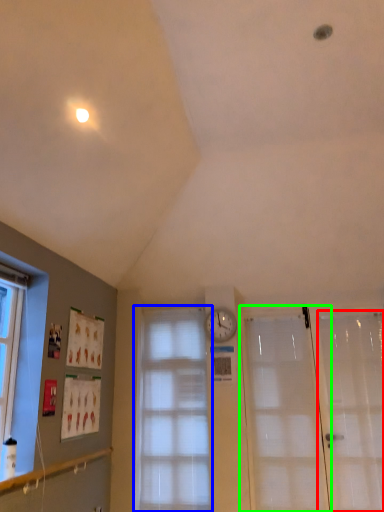
Question: Estimate the real-world distances between objects in this image. Which object is farther from screen door (highlighted by a red box), window (highlighted by a blue box) or door (highlighted by a green box)?

Choices:
 (A) window
 (B) door

Answer: (A)